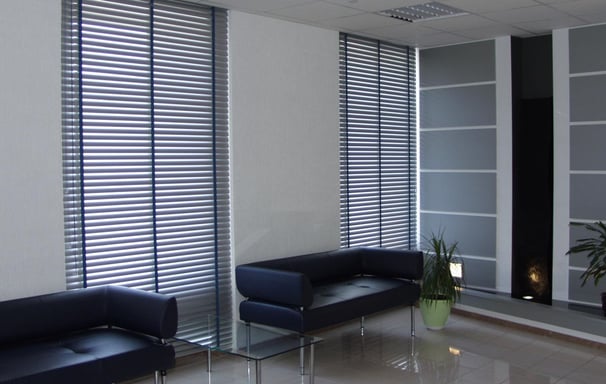
The width and height of the screenshot is (606, 384). Find the location of `wall`. wall is located at coordinates (304, 173), (39, 199).